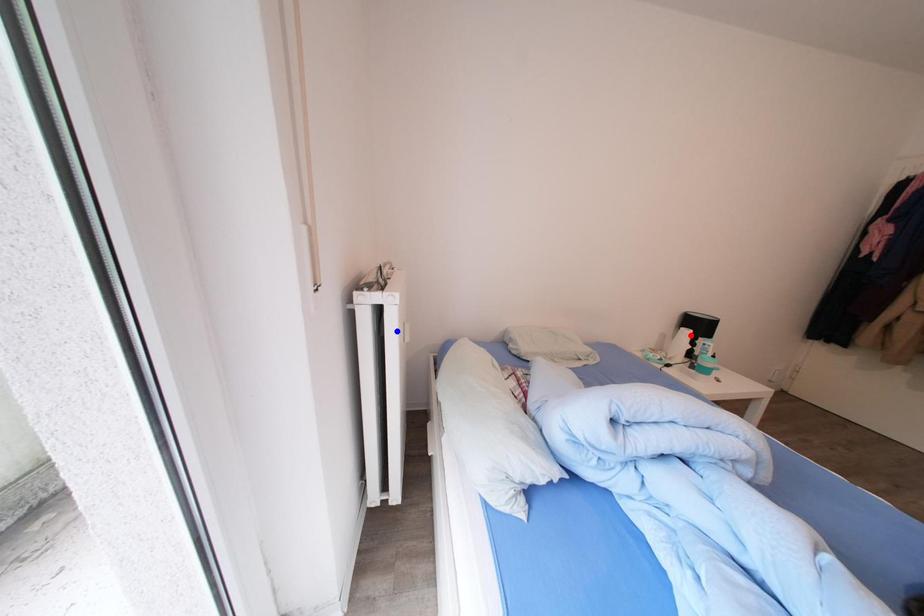
Question: Two points are marked on the image. Which point is closer to the camera?

Choices:
 (A) Blue point is closer.
 (B) Red point is closer.

Answer: (A)